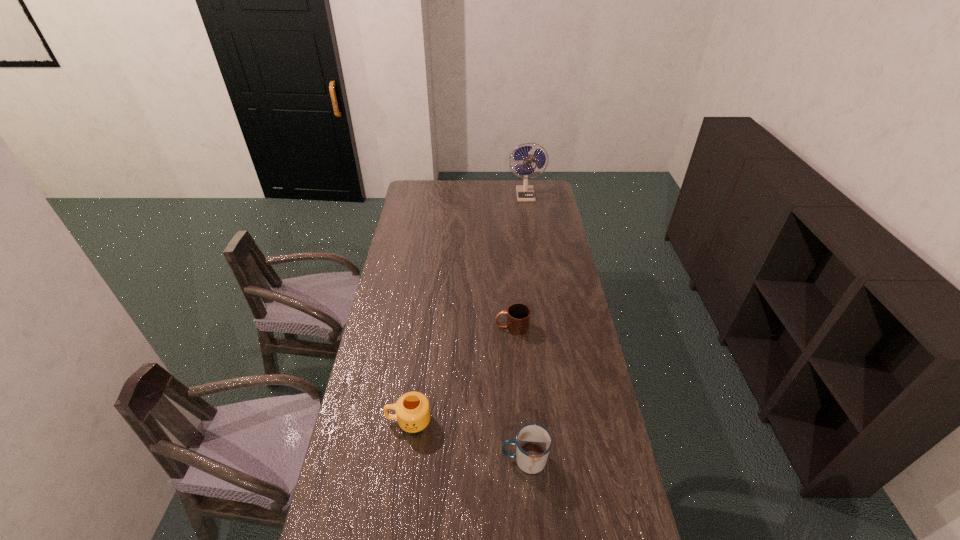
Locate which mug is the third closest to the farthest object. Please provide its 2D coordinates. Your answer should be formatted as a tuple, i.e. [(x, y)], where the tuple contains the x and y coordinates of a point satisfying the conditions above.

[(533, 442)]

Find the location of `free space that satisfies the following two spatial constraints: 1. on the front-facing side of the tallest object; 2. on the handle side of the leftmost mug`. free space that satisfies the following two spatial constraints: 1. on the front-facing side of the tallest object; 2. on the handle side of the leftmost mug is located at coordinates (560, 421).

The image size is (960, 540). What are the coordinates of `free space that satisfies the following two spatial constraints: 1. on the front-facing side of the tallest object; 2. on the side of the shortest object with the handle` in the screenshot? It's located at (545, 327).

You are a GUI agent. You are given a task and a screenshot of the screen. Output one action in this format:
    pyautogui.click(x=<x>, y=<y>)
    Task: Click on the vacant region that satisfies the following two spatial constraints: 1. on the front-facing side of the farthest object; 2. on the side of the second farthest object with the handle
    This screenshot has height=540, width=960.
    Given the screenshot: What is the action you would take?
    pyautogui.click(x=545, y=327)